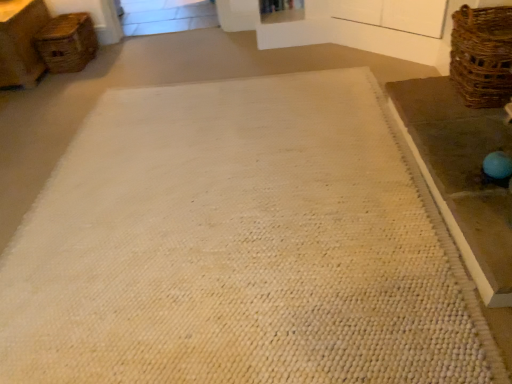
Question: Considering the relative sizes of brown woven basket at right, which is the 2th basket in back-to-front order, and brown woven table at right in the image provided, is brown woven basket at right, which is the 2th basket in back-to-front order, shorter than brown woven table at right?

Choices:
 (A) yes
 (B) no

Answer: (B)

Question: Would you say brown woven basket at right, positioned as the 1th basket in bottom-to-top order, is outside brown woven table at right?

Choices:
 (A) yes
 (B) no

Answer: (A)

Question: Is brown woven basket at right, arranged as the 2th basket when viewed from the left, oriented towards brown woven table at right?

Choices:
 (A) yes
 (B) no

Answer: (B)

Question: Does brown woven basket at right, arranged as the 2th basket when viewed from the left, come behind brown woven table at right?

Choices:
 (A) no
 (B) yes

Answer: (B)

Question: Is brown woven basket at right, which is the 2th basket in back-to-front order, looking in the opposite direction of brown woven table at right?

Choices:
 (A) no
 (B) yes

Answer: (A)

Question: Is brown woven table at right wider or thinner than woven brown basket at upper left, the 2th basket in the right-to-left sequence?

Choices:
 (A) thin
 (B) wide

Answer: (B)

Question: From a real-world perspective, relative to woven brown basket at upper left, placed as the 1th basket when sorted from back to front, is brown woven table at right vertically above or below?

Choices:
 (A) below
 (B) above

Answer: (A)

Question: Is brown woven table at right situated inside woven brown basket at upper left, which appears as the 1th basket when viewed from the top, or outside?

Choices:
 (A) outside
 (B) inside

Answer: (A)

Question: Relative to woven brown basket at upper left, the 2th basket in the right-to-left sequence, is brown woven table at right in front or behind?

Choices:
 (A) front
 (B) behind

Answer: (A)

Question: Do you think woven brown basket at upper left, the 2th basket in the right-to-left sequence, is within brown woven basket at right, which is counted as the 1th basket, starting from the right, or outside of it?

Choices:
 (A) outside
 (B) inside

Answer: (A)

Question: In terms of size, does woven brown basket at upper left, which appears as the 1th basket when viewed from the top, appear bigger or smaller than brown woven basket at right, which is counted as the 1th basket, starting from the right?

Choices:
 (A) big
 (B) small

Answer: (A)

Question: From their relative heights in the image, would you say woven brown basket at upper left, placed as the 1th basket when sorted from back to front, is taller or shorter than brown woven basket at right, which is the second basket in top-to-bottom order?

Choices:
 (A) short
 (B) tall

Answer: (A)

Question: From a real-world perspective, is woven brown basket at upper left, which appears as the 1th basket when viewed from the top, positioned above or below brown woven basket at right, positioned as the 1th basket in bottom-to-top order?

Choices:
 (A) above
 (B) below

Answer: (B)

Question: Looking at their shapes, would you say brown woven table at right is wider or thinner than brown woven basket at right, positioned as the 1th basket in bottom-to-top order?

Choices:
 (A) wide
 (B) thin

Answer: (A)

Question: Is brown woven table at right spatially inside brown woven basket at right, positioned as the 1th basket in bottom-to-top order, or outside of it?

Choices:
 (A) outside
 (B) inside

Answer: (A)